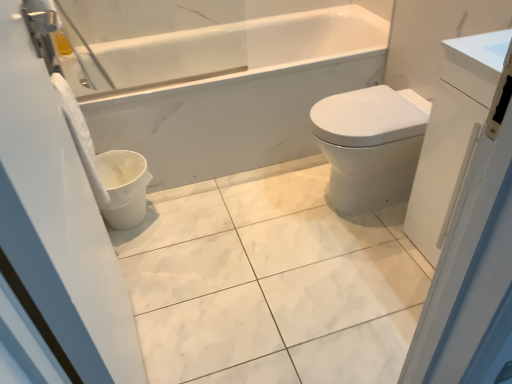
Locate an element on the screen. white matte toilet paper at left is located at coordinates (80, 137).

The height and width of the screenshot is (384, 512). What do you see at coordinates (123, 187) in the screenshot?
I see `white glossy toilet bowl at lower left` at bounding box center [123, 187].

Where is `white glossy cabinet at right, which ranks as the second screen door in left-to-right order`? white glossy cabinet at right, which ranks as the second screen door in left-to-right order is located at coordinates (473, 230).

Does point (82, 118) lie behind point (115, 351)?

Yes, it is behind point (115, 351).

How distant is white matte toilet paper at left from white glossy screen door at left, which ranks as the first screen door in left-to-right order?

white matte toilet paper at left is 21.29 inches from white glossy screen door at left, which ranks as the first screen door in left-to-right order.

From a real-world perspective, is white matte toilet paper at left on top of white glossy screen door at left, placed as the second screen door when sorted from right to left?

No, from a real-world perspective, white matte toilet paper at left is not over white glossy screen door at left, placed as the second screen door when sorted from right to left

Is white glossy screen door at left, placed as the second screen door when sorted from right to left, completely or partially inside white matte toilet paper at left?

No, white glossy screen door at left, placed as the second screen door when sorted from right to left, is not surrounded by white matte toilet paper at left.

Is white glossy bidet at right not near white marble tile at center?

white glossy bidet at right is actually quite close to white marble tile at center.

Is white glossy bidet at right to the right of white marble tile at center from the viewer's perspective?

Yes, white glossy bidet at right is to the right of white marble tile at center.

Is point (318, 129) closer to camera compared to point (246, 222)?

Yes, point (318, 129) is in front of point (246, 222).

Is white glossy bidet at right thinner than white marble tile at center?

Correct, the width of white glossy bidet at right is less than that of white marble tile at center.

Based on the photo, do you think white glossy screen door at left, which ranks as the first screen door in left-to-right order, is within white matte toilet paper at left, or outside of it?

white glossy screen door at left, which ranks as the first screen door in left-to-right order, is not enclosed by white matte toilet paper at left.

Is white glossy screen door at left, placed as the second screen door when sorted from right to left, far from white matte toilet paper at left?

That's not correct — white glossy screen door at left, placed as the second screen door when sorted from right to left, is a little close to white matte toilet paper at left.

Who is smaller, white glossy screen door at left, which ranks as the first screen door in left-to-right order, or white matte toilet paper at left?

With smaller size is white matte toilet paper at left.

From a real-world perspective, between white glossy screen door at left, which ranks as the first screen door in left-to-right order, and white matte toilet paper at left, who is vertically higher?

From a 3D spatial view, white glossy screen door at left, which ranks as the first screen door in left-to-right order, is above.

Based on the photo, is white matte toilet paper at left next to white glossy bidet at right and touching it?

There is a gap between white matte toilet paper at left and white glossy bidet at right.

In the scene shown: From the image's perspective, is white matte toilet paper at left positioned above or below white glossy bidet at right?

white matte toilet paper at left is situated higher than white glossy bidet at right in the image.

Which object is positioned more to the right, white matte toilet paper at left or white glossy bidet at right?

Positioned to the right is white glossy bidet at right.

How much distance is there between white matte toilet paper at left and white glossy bidet at right?

white matte toilet paper at left and white glossy bidet at right are 3.40 feet apart from each other.

Is white glossy cabinet at right, which ranks as the second screen door in left-to-right order, shorter than white glossy screen door at left, which ranks as the first screen door in left-to-right order?

Yes.

Who is smaller, white glossy cabinet at right, which ranks as the second screen door in left-to-right order, or white glossy screen door at left, which ranks as the first screen door in left-to-right order?

With smaller size is white glossy screen door at left, which ranks as the first screen door in left-to-right order.

Locate an element on the screen. This screenshot has width=512, height=384. screen door behind the white glossy screen door at left, which ranks as the first screen door in left-to-right order is located at coordinates (473, 230).

Which object is more forward, white glossy cabinet at right, which ranks as the second screen door in left-to-right order, or white glossy screen door at left, which ranks as the first screen door in left-to-right order?

white glossy screen door at left, which ranks as the first screen door in left-to-right order, is in front.

Locate an element on the screen. toilet bowl below the white glossy bidet at right (from the image's perspective) is located at coordinates click(x=123, y=187).

Based on the photo, relative to white glossy bidet at right, is white glossy toilet bowl at lower left in front or behind?

white glossy toilet bowl at lower left is behind white glossy bidet at right.

From a real-world perspective, is white glossy toilet bowl at lower left located higher than white glossy bidet at right?

No, from a real-world perspective, white glossy toilet bowl at lower left is not on top of white glossy bidet at right.

What's the angular difference between white matte toilet paper at left and white glossy cabinet at right, which ranks as the second screen door in left-to-right order,'s facing directions?

The facing directions of white matte toilet paper at left and white glossy cabinet at right, which ranks as the second screen door in left-to-right order, are 179 degrees apart.

Is the position of white matte toilet paper at left less distant than that of white glossy cabinet at right, which ranks as the second screen door in left-to-right order?

No, white matte toilet paper at left is behind white glossy cabinet at right, which ranks as the second screen door in left-to-right order.

Between white matte toilet paper at left and white glossy cabinet at right, which ranks as the second screen door in left-to-right order, which one has more height?

white glossy cabinet at right, which ranks as the second screen door in left-to-right order.

From the white matte toilet paper at left, count 2nd screen door to the right and point to it. Please provide its 2D coordinates.

[(473, 230)]

From the image's perspective, count 2nd screen doors downward from the white matte toilet paper at left and point to it. Please provide its 2D coordinates.

[(58, 220)]

You are a GUI agent. You are given a task and a screenshot of the screen. Output one action in this format:
    pyautogui.click(x=<x>, y=<y>)
    Task: Click on the ceramic tile to the left of white glossy bidet at right
    
    Given the screenshot: What is the action you would take?
    pyautogui.click(x=271, y=282)

From the picture: When comparing their distances from white glossy toilet bowl at lower left, does white marble tile at center or white glossy cabinet at right, which ranks as the second screen door in left-to-right order, seem closer?

white marble tile at center lies closer to white glossy toilet bowl at lower left than the other object.

Which object lies nearer to the anchor point white matte toilet paper at left, white glossy toilet bowl at lower left or white glossy cabinet at right, the 1th screen door positioned from the right?

Based on the image, white glossy toilet bowl at lower left appears to be nearer to white matte toilet paper at left.

From the picture: When comparing their distances from white glossy bidet at right, does white marble tile at center or white glossy toilet bowl at lower left seem closer?

Among the two, white marble tile at center is located nearer to white glossy bidet at right.

Based on their spatial positions, is white glossy bidet at right or white matte toilet paper at left closer to white marble tile at center?

Based on the image, white glossy bidet at right appears to be nearer to white marble tile at center.

From the image, which object appears to be farther from white glossy bidet at right, white matte toilet paper at left or white glossy toilet bowl at lower left?

The object further to white glossy bidet at right is white matte toilet paper at left.

Considering their positions, is white glossy screen door at left, which ranks as the first screen door in left-to-right order, positioned closer to white glossy cabinet at right, which ranks as the second screen door in left-to-right order, than white glossy toilet bowl at lower left?

white glossy screen door at left, which ranks as the first screen door in left-to-right order, is closer to white glossy cabinet at right, which ranks as the second screen door in left-to-right order.

Based on their spatial positions, is white glossy bidet at right or white marble tile at center further from white glossy screen door at left, placed as the second screen door when sorted from right to left?

The object further to white glossy screen door at left, placed as the second screen door when sorted from right to left, is white glossy bidet at right.

Based on their spatial positions, is white glossy cabinet at right, the 1th screen door positioned from the right, or white glossy screen door at left, which ranks as the first screen door in left-to-right order, closer to white matte toilet paper at left?

white glossy screen door at left, which ranks as the first screen door in left-to-right order, is positioned closer to the anchor white matte toilet paper at left.

I want to click on ceramic tile located between white glossy screen door at left, placed as the second screen door when sorted from right to left, and white glossy cabinet at right, the 1th screen door positioned from the right, in the left-right direction, so click(271, 282).

The image size is (512, 384). I want to click on toilet bowl situated between white matte toilet paper at left and white glossy cabinet at right, which ranks as the second screen door in left-to-right order, from left to right, so click(123, 187).

Identify the location of toilet paper between white glossy screen door at left, which ranks as the first screen door in left-to-right order, and white glossy toilet bowl at lower left from front to back. (80, 137).

Find the location of `bidet located between white glossy screen door at left, placed as the second screen door when sorted from right to left, and white glossy cabinet at right, which ranks as the second screen door in left-to-right order, in the left-right direction`. bidet located between white glossy screen door at left, placed as the second screen door when sorted from right to left, and white glossy cabinet at right, which ranks as the second screen door in left-to-right order, in the left-right direction is located at coordinates (369, 146).